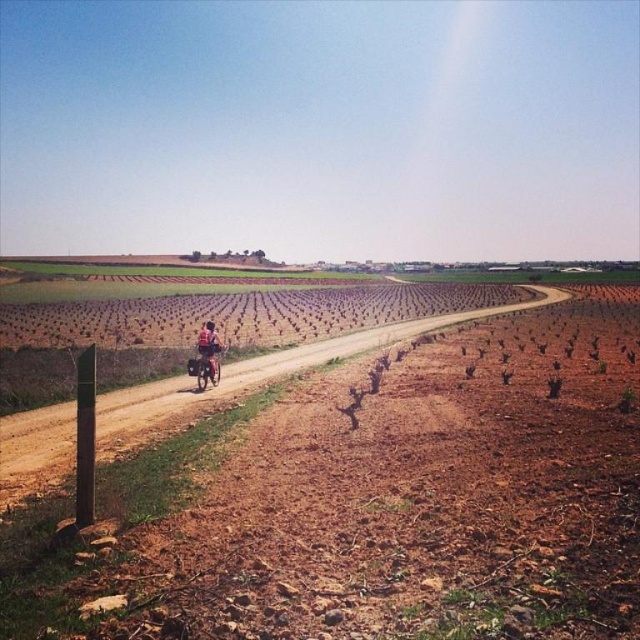
Which is above, metallic silver dirt bike at center or matte black bicycle at center?

matte black bicycle at center is above.

Find the location of a particular element. metallic silver dirt bike at center is located at coordinates (205, 365).

Between point (209, 356) and point (200, 332), which one is positioned behind?

Positioned behind is point (200, 332).

I want to click on metallic silver dirt bike at center, so click(205, 365).